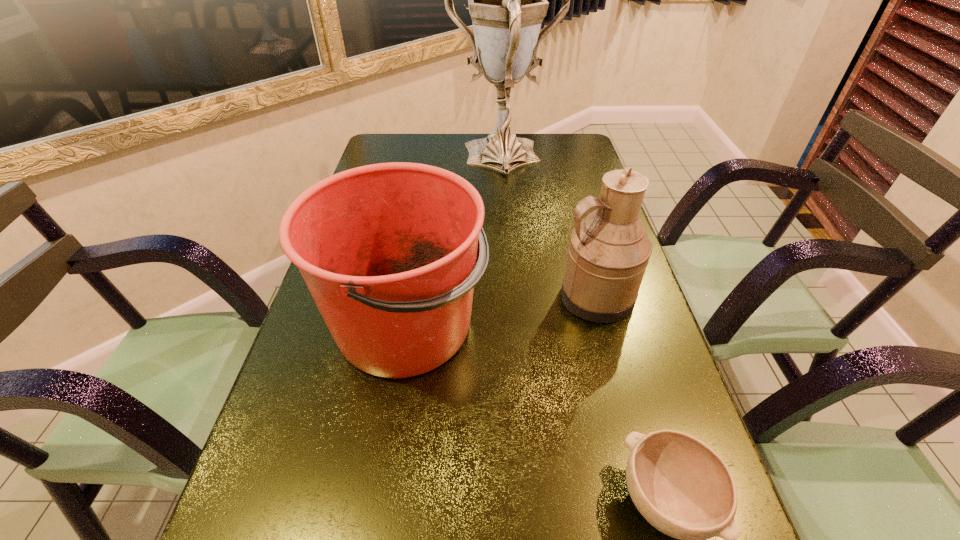
Find the location of a particular element. the third closest object to the farthest object is located at coordinates (682, 487).

Where is `object that stands as the second closest to the tallest object`? The width and height of the screenshot is (960, 540). object that stands as the second closest to the tallest object is located at coordinates (608, 253).

Find the location of a particular element. free space that satisfies the following two spatial constraints: 1. on the back side of the bucket; 2. on the right side of the farthest object is located at coordinates (433, 158).

Where is `vacant area that satisfies the following two spatial constraints: 1. on the front side of the tallest object; 2. on the left side of the pitcher`? vacant area that satisfies the following two spatial constraints: 1. on the front side of the tallest object; 2. on the left side of the pitcher is located at coordinates (515, 296).